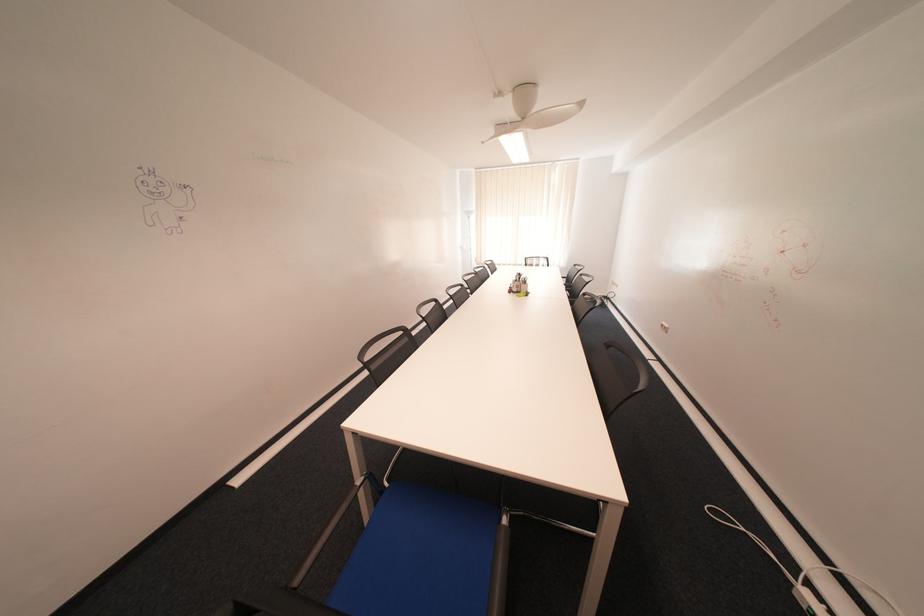
Find where to sit the blue chair sitting surface. Please return your answer as a coordinate pair (x, y).

(433, 570)